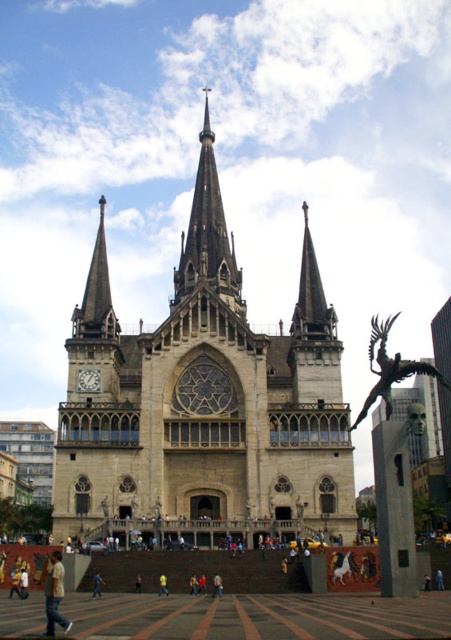
Based on the photo, you are standing in the public square in front of the cathedral. You notice the smooth gray steeple at upper left and the light brown leather pants at lower left. Which object is closer to you?

The smooth gray steeple at upper left is closer to you because it is further to the viewer than the light brown leather pants at lower left.

You are standing in the public square in front of the cathedral. If you look directly ahead, where would you see the smooth stone spire at upper center?

The smooth stone spire at upper center is located at the coordinates 0.464 on the horizontal axis and 0.692 on the vertical axis, so if you look directly ahead, you would see it slightly to the left of center and two thirds of the way up from the bottom of the cathedral facade.